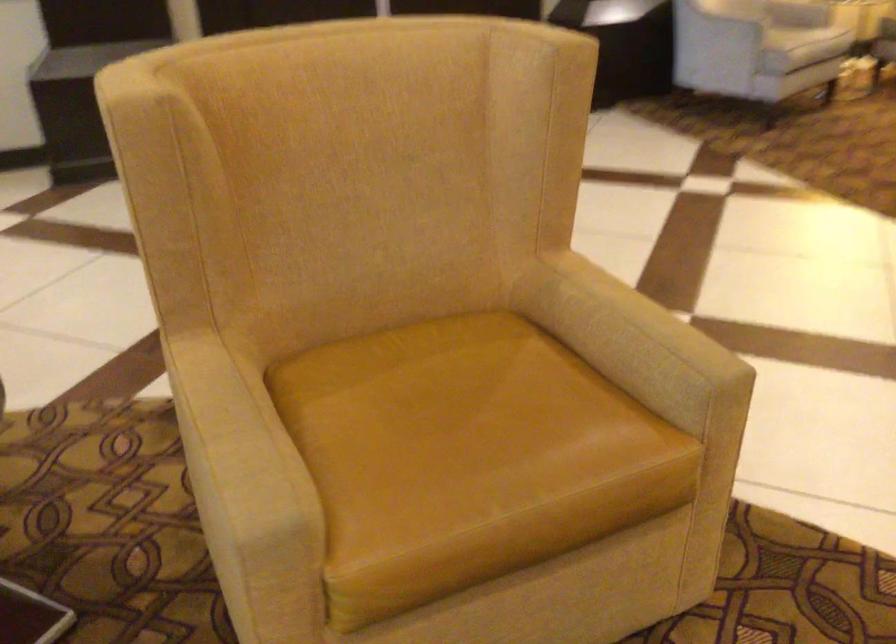
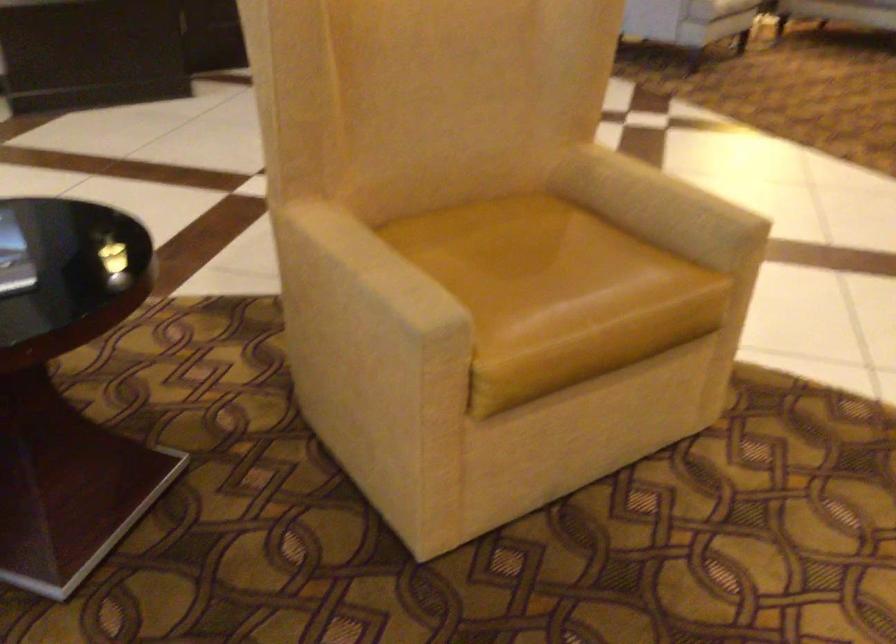
In the second image, find the point that corresponds to point 444,404 in the first image.

(520, 256)